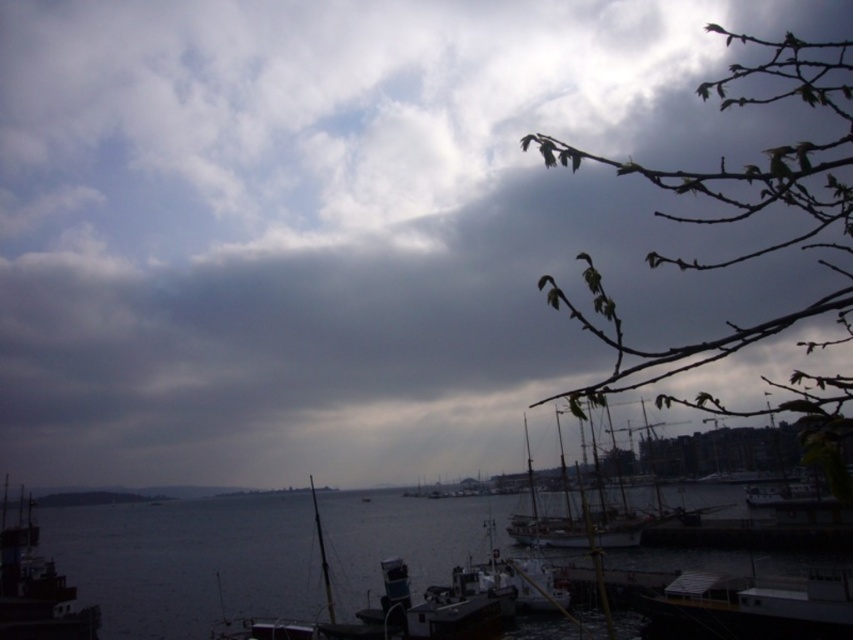
Which is behind, point (82, 627) or point (549, 534)?

Point (549, 534)

Can you confirm if metallic gray boat at lower left is positioned above white wooden sailboat at center?

No.

Which is behind, point (10, 609) or point (606, 548)?

The point (606, 548) is more distant.

Where is `metallic gray boat at lower left`? This screenshot has width=853, height=640. metallic gray boat at lower left is located at coordinates (35, 586).

Does dark water at lower center appear on the right side of white wooden sailboat at center?

In fact, dark water at lower center is to the left of white wooden sailboat at center.

Does dark water at lower center lie behind white wooden sailboat at center?

Yes.

Who is more forward, (99, 564) or (570, 541)?

Point (570, 541)

Find the location of a particular element. dark water at lower center is located at coordinates (187, 561).

Is dark water at lower center bigger than metallic gray boat at lower left?

Yes.

Which is behind, point (67, 564) or point (32, 548)?

Positioned behind is point (67, 564).

Locate an element on the screen. The width and height of the screenshot is (853, 640). dark water at lower center is located at coordinates click(187, 561).